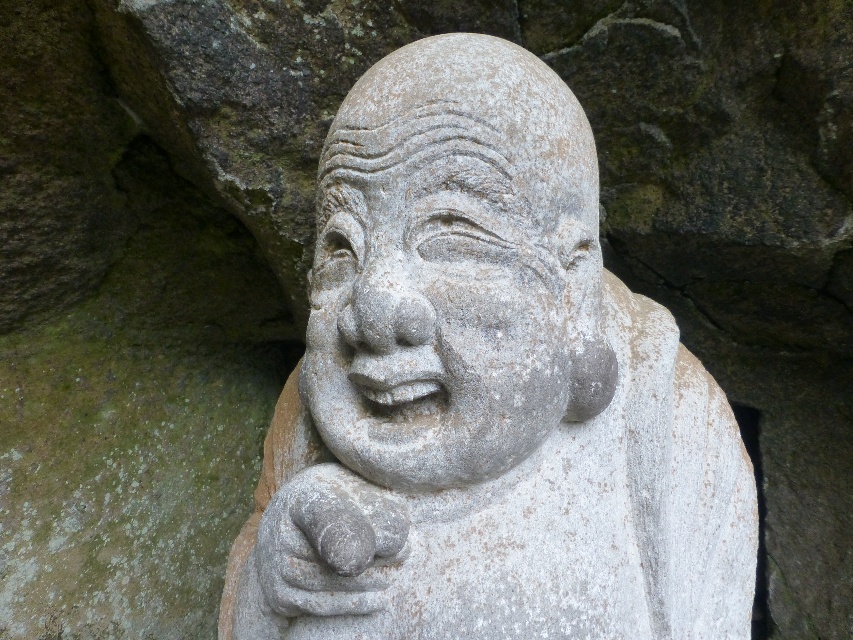
You are an art curator organizing an exhibition. You have two statues in front of you, the white stone statue at center and the gray stone statue at center. Based on their positions, which statue should you move to the right side to align them properly?

The white stone statue at center should be moved to the right side because it is currently positioned on the left side of the gray stone statue at center, so moving it would correct their alignment.

You are standing in front of the stone sculpture of a seated figure. The statue is marked with a point at coordinates (485, 392). If you want to place a small offering plate exactly at the base of the statue, where should you place it relative to the marked point?

The white stone statue at center is represented by point (485, 392). To place the offering plate at the base, position it directly below this point along the vertical axis.

You are standing in front of the white stone statue at center and want to take a photo of it with your phone. Your phone has a maximum focus distance of 28 inches. Will you be able to focus on the statue clearly?

The white stone statue at center is 28.59 inches away from you, which exceeds your phone camera maximum focus distance of 28 inches. Therefore, you won not be able to focus on the statue clearly.